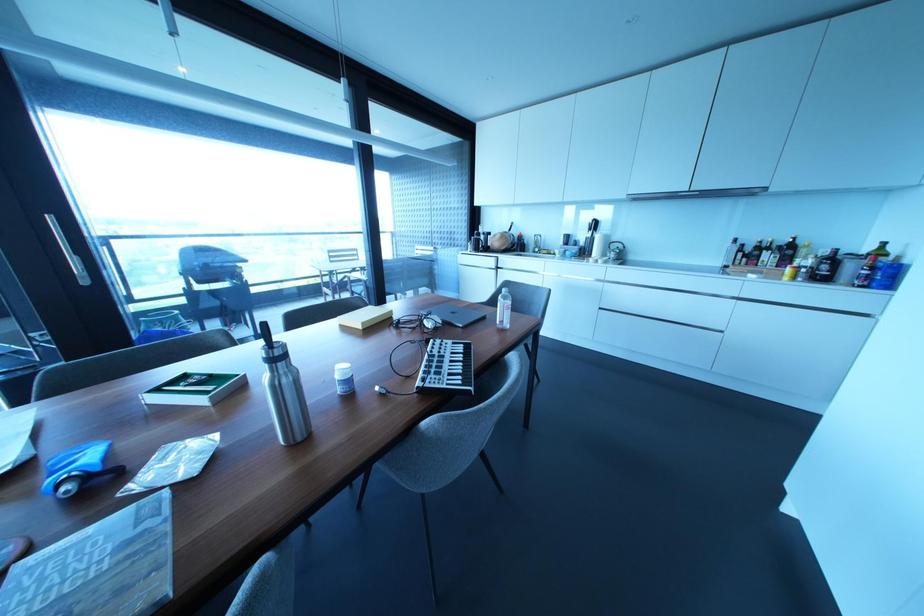
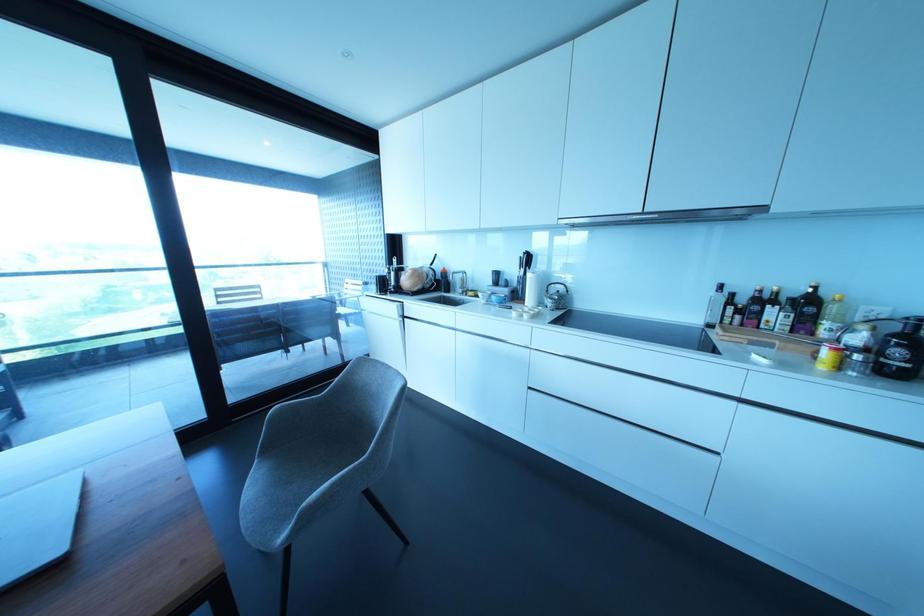
Find the pixel in the second image that matches point (612, 254) in the first image.

(549, 302)